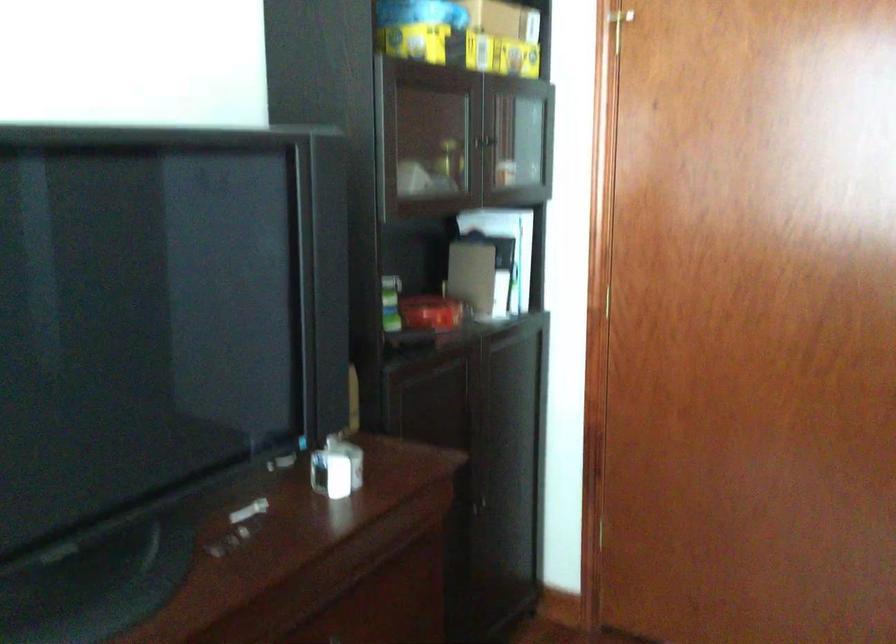
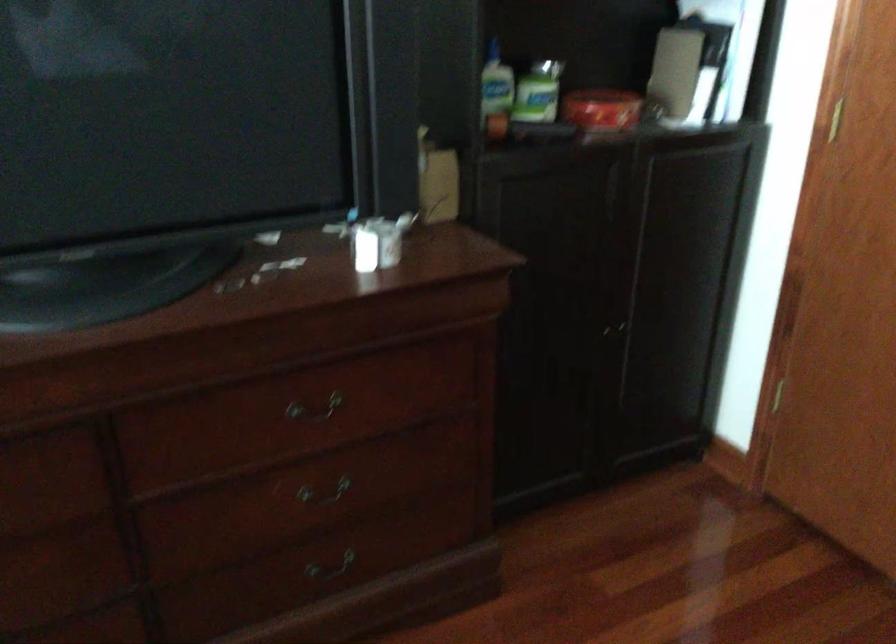
Find the pixel in the second image that matches point 380,307 in the first image.

(538, 91)